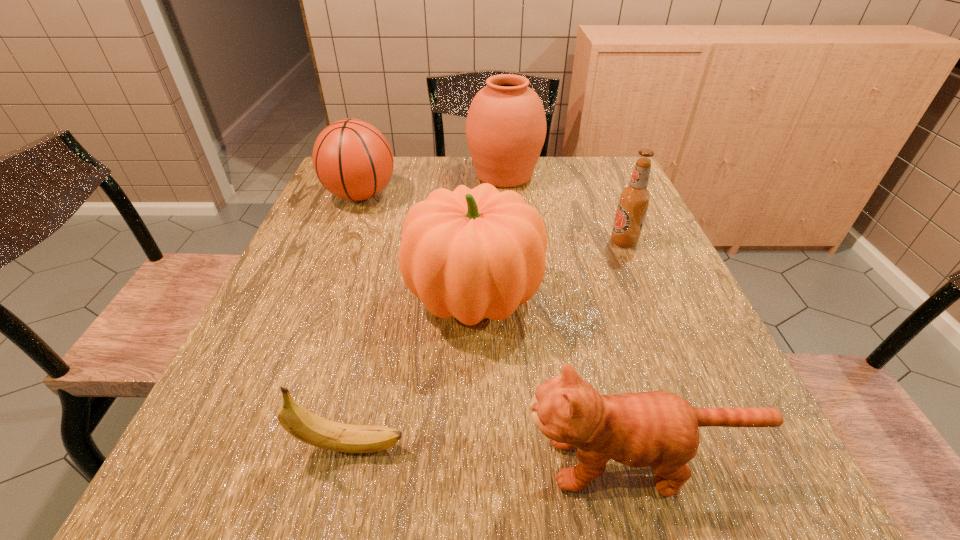
You are a GUI agent. You are given a task and a screenshot of the screen. Output one action in this format:
    pyautogui.click(x=<x>, y=<y>)
    Task: Click on the vacant space located on the front label of the beer bottle
    
    Given the screenshot: What is the action you would take?
    pyautogui.click(x=492, y=242)

Where is `free region located on the right of the basketball`? This screenshot has width=960, height=540. free region located on the right of the basketball is located at coordinates (540, 195).

Find the location of a particular element. The image size is (960, 540). vacant space situated on the face of the cat is located at coordinates (285, 462).

Where is `blank space located 0.320m on the face of the cat`? This screenshot has height=540, width=960. blank space located 0.320m on the face of the cat is located at coordinates (305, 462).

Locate an element on the screen. vacant region located on the face of the cat is located at coordinates (381, 462).

Locate an element on the screen. The image size is (960, 540). vacant space located 0.110m at the start of the peel on the banana is located at coordinates (478, 446).

Where is `urn positioned at the far edge`? The height and width of the screenshot is (540, 960). urn positioned at the far edge is located at coordinates (506, 126).

You are a GUI agent. You are given a task and a screenshot of the screen. Output one action in this format:
    pyautogui.click(x=<x>, y=<y>)
    Task: Click on the basketball that is at the far edge
    This screenshot has height=540, width=960.
    Given the screenshot: What is the action you would take?
    pyautogui.click(x=352, y=159)

Where is `cat present at the near edge`? This screenshot has width=960, height=540. cat present at the near edge is located at coordinates (659, 429).

Where is `banana that is at the near edge`? The image size is (960, 540). banana that is at the near edge is located at coordinates point(305,426).